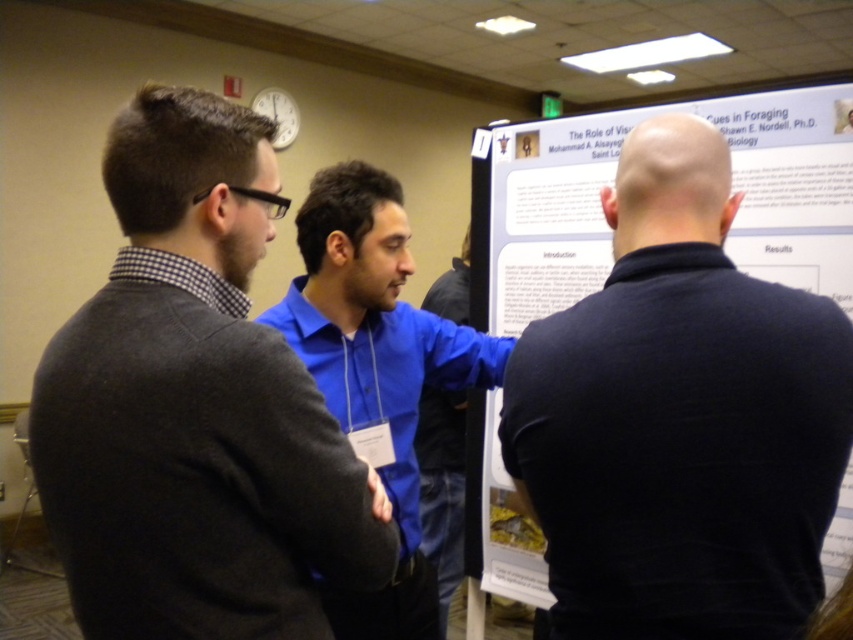
Question: Observing the image, what is the correct spatial positioning of black matte shirt at center in reference to blue smooth shirt at center?

Choices:
 (A) below
 (B) above

Answer: (B)

Question: Which object appears closest to the camera in this image?

Choices:
 (A) blue smooth shirt at center
 (B) dark gray sweater at left
 (C) black matte shirt at center
 (D) blue shirt at center

Answer: (B)

Question: Can you confirm if dark gray sweater at left is smaller than black matte shirt at center?

Choices:
 (A) no
 (B) yes

Answer: (B)

Question: Among these points, which one is farthest from the camera?

Choices:
 (A) click(392, 396)
 (B) click(753, 346)
 (C) click(241, 573)

Answer: (A)

Question: Which of the following is the closest to the observer?

Choices:
 (A) blue smooth shirt at center
 (B) dark gray sweater at left

Answer: (B)

Question: Does blue shirt at center appear on the left side of blue smooth shirt at center?

Choices:
 (A) yes
 (B) no

Answer: (A)